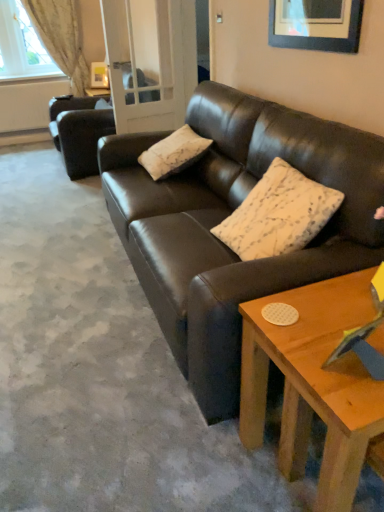
Where is `free space above wooden coffee table at lower right (from a real-world perspective)`? The width and height of the screenshot is (384, 512). free space above wooden coffee table at lower right (from a real-world perspective) is located at coordinates (329, 322).